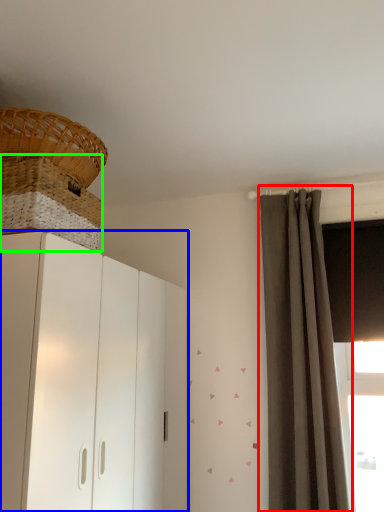
Question: Which is nearer to the curtain (highlighted by a red box)? cupboard (highlighted by a blue box) or basket (highlighted by a green box).

Choices:
 (A) cupboard
 (B) basket

Answer: (A)